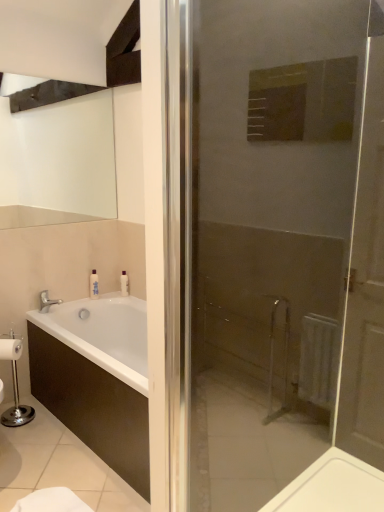
Question: Does white wooden door at center lie in front of white glossy bottle at upper left?

Choices:
 (A) no
 (B) yes

Answer: (B)

Question: Is white wooden door at center far away from white glossy bottle at upper left?

Choices:
 (A) yes
 (B) no

Answer: (A)

Question: Does white wooden door at center have a greater width compared to white glossy bottle at upper left?

Choices:
 (A) no
 (B) yes

Answer: (B)

Question: Considering the relative sizes of white wooden door at center and white glossy bottle at upper left in the image provided, is white wooden door at center shorter than white glossy bottle at upper left?

Choices:
 (A) no
 (B) yes

Answer: (A)

Question: Considering the relative sizes of white wooden door at center and white glossy bottle at upper left in the image provided, is white wooden door at center thinner than white glossy bottle at upper left?

Choices:
 (A) yes
 (B) no

Answer: (B)

Question: In the image, is white wooden door at center positioned in front of or behind white glossy bottle at upper left?

Choices:
 (A) behind
 (B) front

Answer: (B)

Question: Is white wooden door at center bigger or smaller than white glossy bottle at upper left?

Choices:
 (A) big
 (B) small

Answer: (A)

Question: In terms of width, does white wooden door at center look wider or thinner when compared to white glossy bottle at upper left?

Choices:
 (A) wide
 (B) thin

Answer: (A)

Question: Is white wooden door at center spatially inside white glossy bottle at upper left, or outside of it?

Choices:
 (A) inside
 (B) outside

Answer: (B)

Question: Considering their positions, is white glossy bottle at upper left located in front of or behind white wooden door at center?

Choices:
 (A) front
 (B) behind

Answer: (B)

Question: Do you think white glossy bottle at upper left is within white wooden door at center, or outside of it?

Choices:
 (A) inside
 (B) outside

Answer: (B)

Question: Is white glossy bottle at upper left bigger or smaller than white wooden door at center?

Choices:
 (A) big
 (B) small

Answer: (B)

Question: Is point 92,288 closer or farther from the camera than point 192,153?

Choices:
 (A) closer
 (B) farther

Answer: (B)

Question: From the image's perspective, is white wooden door at center located above or below silver metallic faucet at lower left?

Choices:
 (A) below
 (B) above

Answer: (B)

Question: Relative to silver metallic faucet at lower left, is white wooden door at center in front or behind?

Choices:
 (A) behind
 (B) front

Answer: (B)